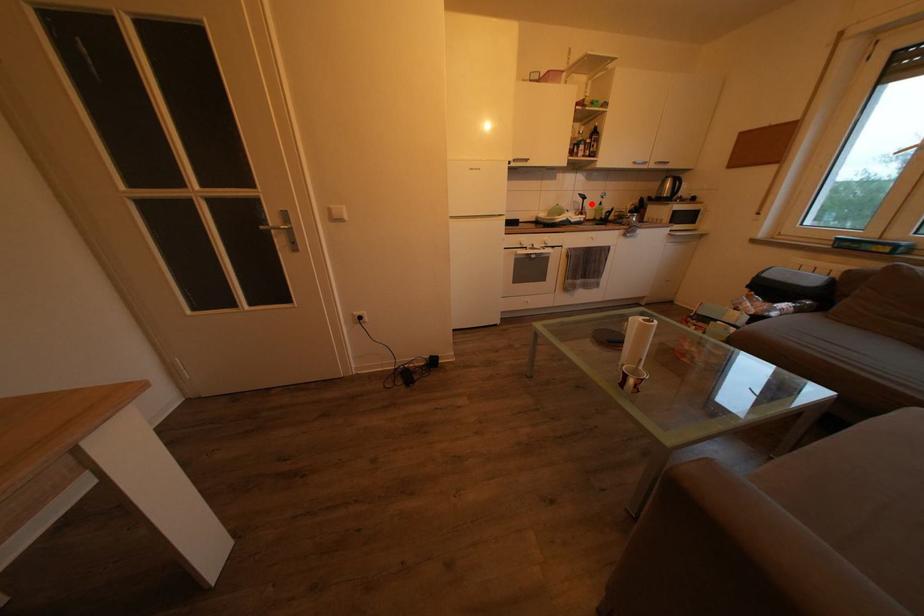
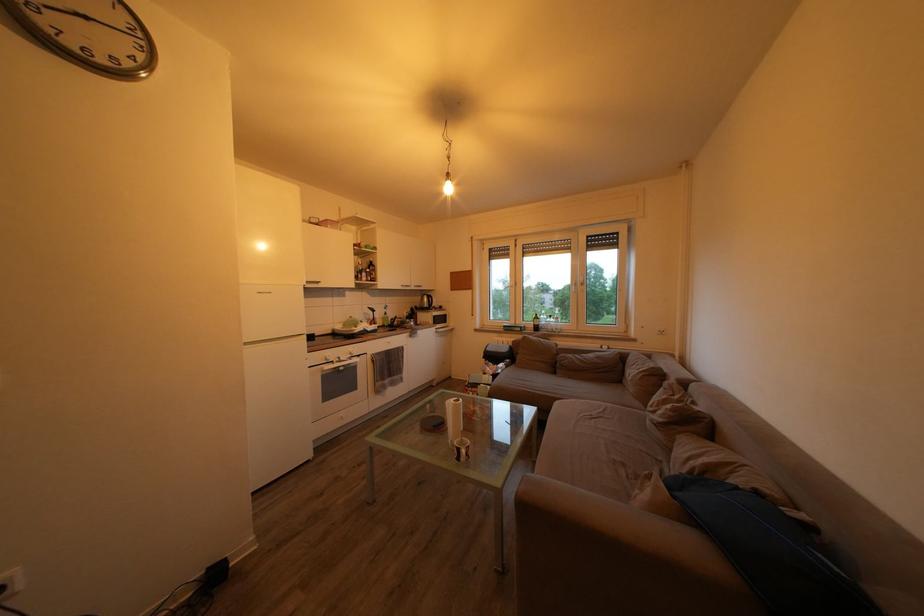
Where in the second image is the point corresponding to the highlighted location from the first image?

(381, 317)